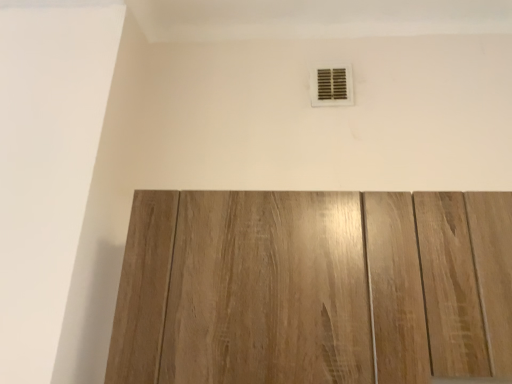
Question: Should I look upward or downward to see matte plastic vent at upper center?

Choices:
 (A) up
 (B) down

Answer: (A)

Question: Can you confirm if matte plastic vent at upper center is smaller than light brown wood door at center?

Choices:
 (A) yes
 (B) no

Answer: (A)

Question: Does matte plastic vent at upper center have a lesser width compared to light brown wood door at center?

Choices:
 (A) no
 (B) yes

Answer: (B)

Question: Is matte plastic vent at upper center at the left side of light brown wood door at center?

Choices:
 (A) no
 (B) yes

Answer: (A)

Question: Could you tell me if matte plastic vent at upper center is turned towards light brown wood door at center?

Choices:
 (A) yes
 (B) no

Answer: (B)

Question: Can you confirm if matte plastic vent at upper center is wider than light brown wood door at center?

Choices:
 (A) no
 (B) yes

Answer: (A)

Question: Considering the relative positions of matte plastic vent at upper center and light brown wood door at center in the image provided, is matte plastic vent at upper center behind light brown wood door at center?

Choices:
 (A) yes
 (B) no

Answer: (A)

Question: Does light brown wood door at center have a lesser width compared to matte plastic vent at upper center?

Choices:
 (A) no
 (B) yes

Answer: (A)

Question: Is light brown wood door at center taller than matte plastic vent at upper center?

Choices:
 (A) no
 (B) yes

Answer: (B)

Question: Is light brown wood door at center facing away from matte plastic vent at upper center?

Choices:
 (A) no
 (B) yes

Answer: (A)

Question: Can you confirm if light brown wood door at center is smaller than matte plastic vent at upper center?

Choices:
 (A) no
 (B) yes

Answer: (A)

Question: Considering the relative positions of light brown wood door at center and matte plastic vent at upper center in the image provided, is light brown wood door at center behind matte plastic vent at upper center?

Choices:
 (A) yes
 (B) no

Answer: (B)

Question: Is light brown wood door at center shorter than matte plastic vent at upper center?

Choices:
 (A) no
 (B) yes

Answer: (A)

Question: Is point (342, 82) closer or farther from the camera than point (256, 362)?

Choices:
 (A) farther
 (B) closer

Answer: (A)